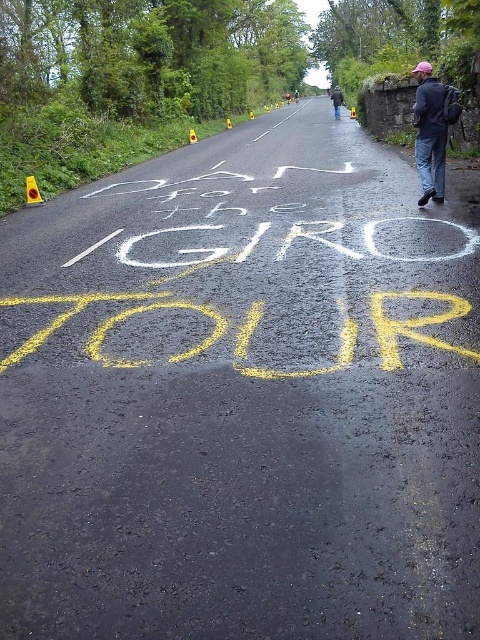
Question: Observing the image, what is the correct spatial positioning of dark blue jacket at right in reference to black jacket at center?

Choices:
 (A) left
 (B) right

Answer: (A)

Question: Which object appears farthest from the camera in this image?

Choices:
 (A) black jacket at center
 (B) dark blue jacket at right

Answer: (A)

Question: Is dark blue jacket at right bigger than black jacket at center?

Choices:
 (A) yes
 (B) no

Answer: (B)

Question: Which point appears farthest from the camera in this image?

Choices:
 (A) (417, 132)
 (B) (338, 115)

Answer: (B)

Question: Can you confirm if dark blue jacket at right is positioned to the right of black jacket at center?

Choices:
 (A) yes
 (B) no

Answer: (B)